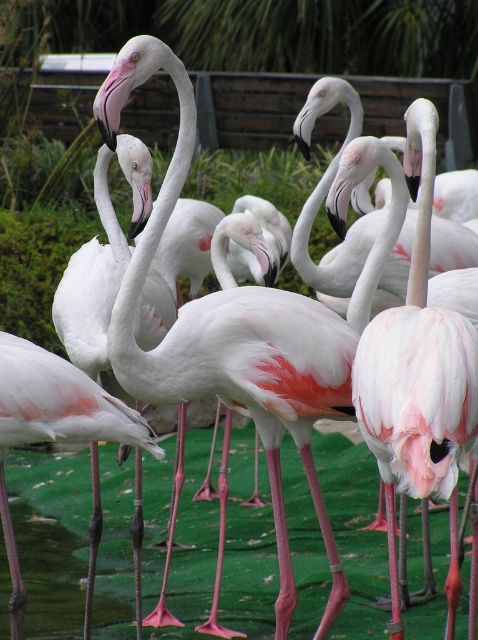
Question: Which object is farther from the camera taking this photo?

Choices:
 (A) pink matte flamingo at center
 (B) matte pink flamingo at center

Answer: (A)

Question: Which point appears farthest from the camera in this image?

Choices:
 (A) (412, 372)
 (B) (82, 397)

Answer: (B)

Question: Is matte pink flamingo at center smaller than pink matte flamingo at center?

Choices:
 (A) yes
 (B) no

Answer: (B)

Question: Is matte pink flamingo at center to the right of pink matte flamingo at center from the viewer's perspective?

Choices:
 (A) no
 (B) yes

Answer: (B)

Question: Which point is farther from the camera taking this photo?

Choices:
 (A) (411, 292)
 (B) (14, 570)

Answer: (B)

Question: Can you confirm if matte pink flamingo at center is positioned below pink matte flamingo at center?

Choices:
 (A) no
 (B) yes

Answer: (A)